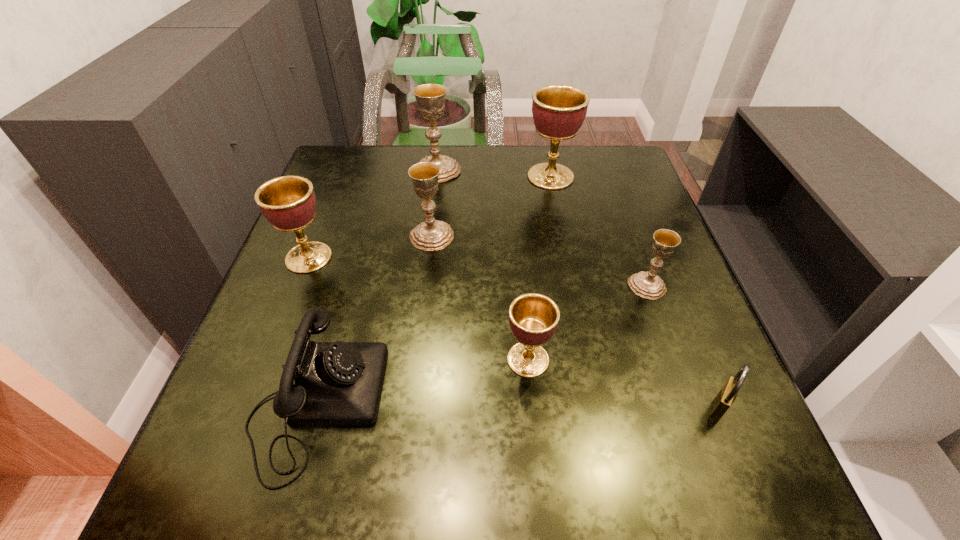
The width and height of the screenshot is (960, 540). In order to click on padlock in this screenshot , I will do `click(724, 399)`.

Find the location of a particular element. This screenshot has height=540, width=960. vacant area situated 0.150m on the left of the biggest gold chalice is located at coordinates (360, 170).

Find the location of a particular element. This screenshot has height=540, width=960. vacant region located on the front of the farthest golden chalice is located at coordinates (558, 214).

At what (x,y) coordinates should I click in order to perform the action: click on vacant space situated on the right of the second farthest gold chalice. Please return your answer as a coordinate pair (x, y). The image size is (960, 540). Looking at the image, I should click on (598, 236).

Find the location of a particular element. This screenshot has height=540, width=960. vacant space located 0.210m on the right of the second farthest golden chalice is located at coordinates (427, 258).

Find the location of `vacant space located 0.150m on the front of the nearest gold chalice`. vacant space located 0.150m on the front of the nearest gold chalice is located at coordinates (674, 363).

Where is `free space located on the right of the smallest golden chalice`? The image size is (960, 540). free space located on the right of the smallest golden chalice is located at coordinates (684, 360).

The height and width of the screenshot is (540, 960). I want to click on blank area located 0.360m on the front face of the telephone, so click(x=594, y=403).

Image resolution: width=960 pixels, height=540 pixels. I want to click on free space located 0.310m on the left of the brass padlock, so click(518, 408).

The image size is (960, 540). I want to click on object situated at the near edge, so click(338, 383).